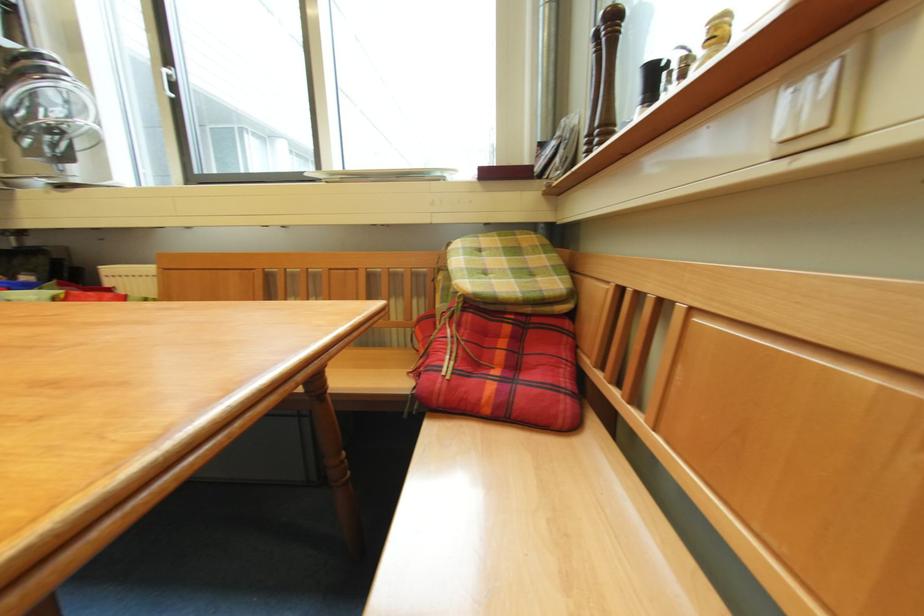
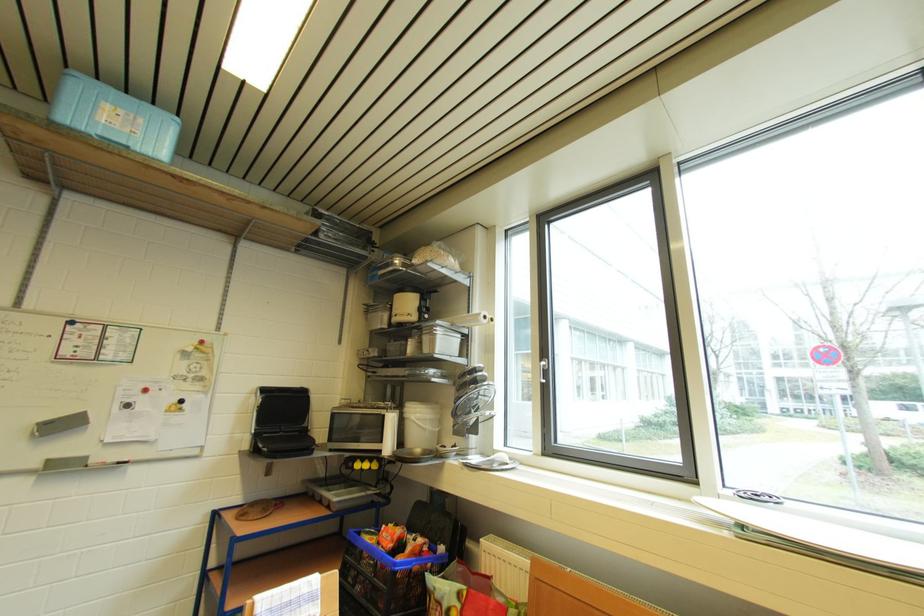
The images are taken continuously from a first-person perspective. In which direction is your viewpoint rotating?

The camera rotated toward left-up.